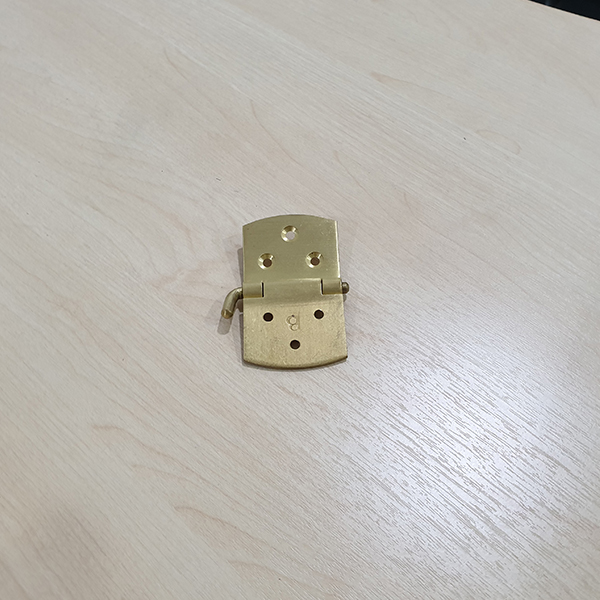
The image size is (600, 600). I want to click on wood grain, so click(200, 472).